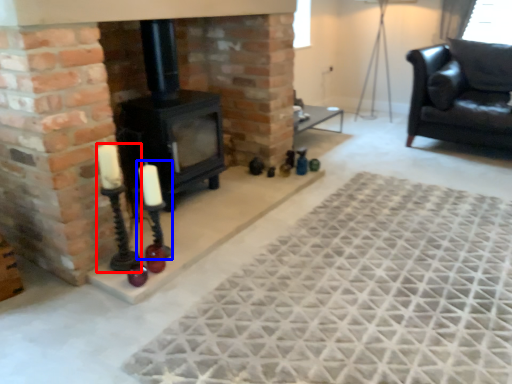
Question: Which of the following is the farthest to the observer, candle holder (highlighted by a red box) or candle holder (highlighted by a blue box)?

Choices:
 (A) candle holder
 (B) candle holder

Answer: (B)